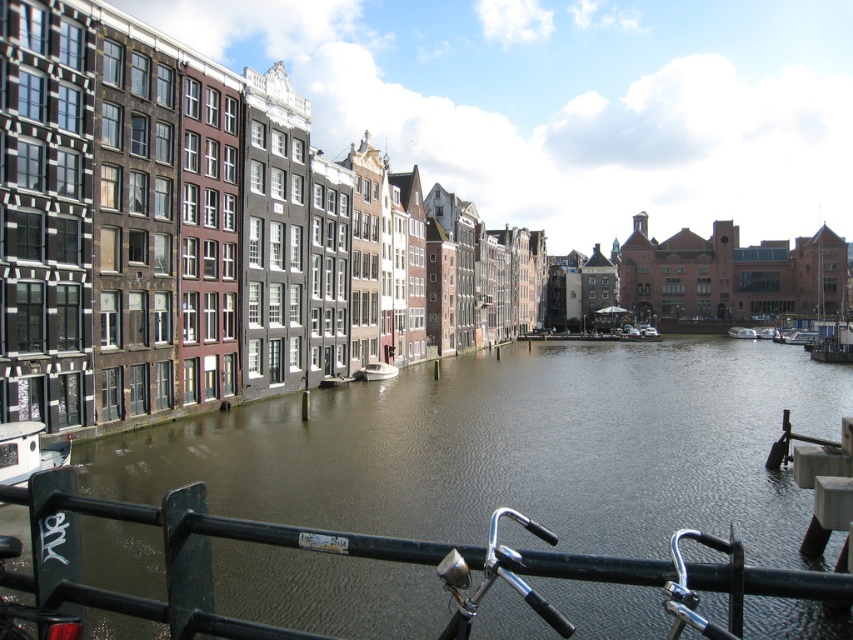
You are standing on the black metal railing in the foreground of the canal scene. You see the brown water at center and the white glossy boat at center. How far apart are these two objects from each other?

The brown water at center is 28.66 meters away from the white glossy boat at center.

Looking at this image, you are a tourist standing on the black metal railing in the foreground of the canal scene. You see the brown water at center and the white glossy boat at center. Which object is higher in elevation compared to the other?

The brown water at center is much taller than the white glossy boat at center, so the brown water at center has a higher elevation.

You are a tourist standing on the black metal railing in the foreground of the canal scene. You see the brown water at center and the white plastic boat at center. Which object is located to the left of the other?

The brown water at center is positioned on the left side of white plastic boat at center, so the brown water at center is to the left of the white plastic boat at center.